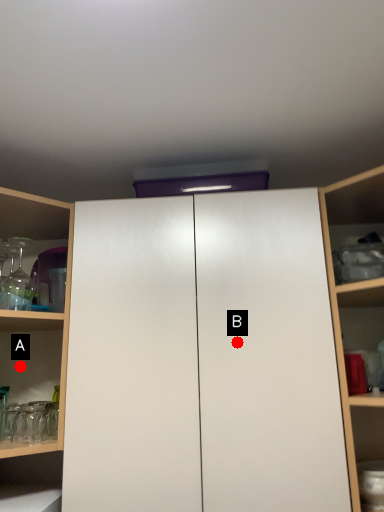
Question: Two points are circled on the image, labeled by A and B beside each circle. Which point is closer to the camera?

Choices:
 (A) A is closer
 (B) B is closer

Answer: (B)